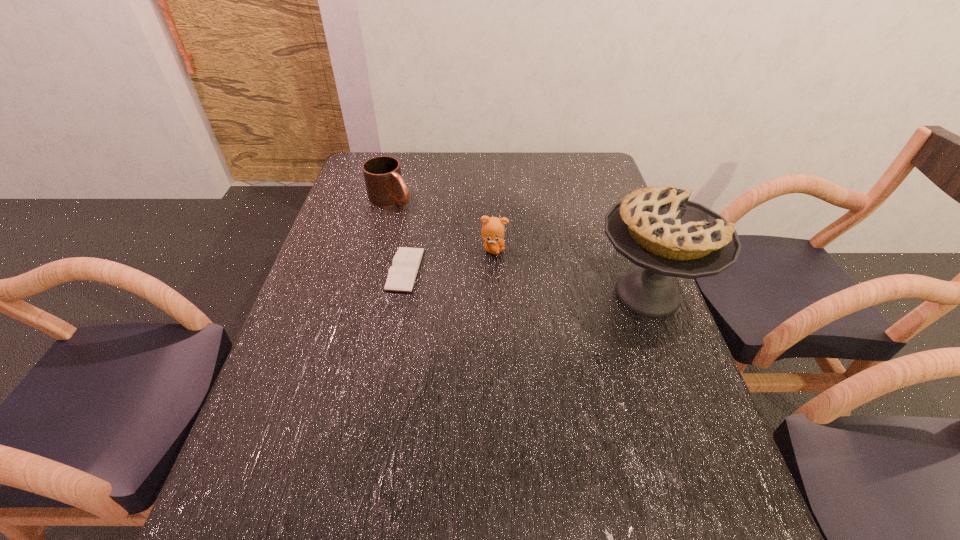
You are a GUI agent. You are given a task and a screenshot of the screen. Output one action in this format:
    pyautogui.click(x=<x>, y=<y>)
    Task: Click on the object that is the third closest to the mug
    
    Given the screenshot: What is the action you would take?
    pyautogui.click(x=657, y=228)

Where is `free point that satisfies the following two spatial constraints: 1. on the front side of the pie; 2. on the cut side of the second object from right to left`? free point that satisfies the following two spatial constraints: 1. on the front side of the pie; 2. on the cut side of the second object from right to left is located at coordinates 495,294.

I want to click on free space that satisfies the following two spatial constraints: 1. on the front side of the pie; 2. on the cut side of the shortest object, so click(401, 294).

The width and height of the screenshot is (960, 540). Find the location of `vacant space that satisfies the following two spatial constraints: 1. on the front side of the mug; 2. on the left side of the diary`. vacant space that satisfies the following two spatial constraints: 1. on the front side of the mug; 2. on the left side of the diary is located at coordinates click(372, 269).

Locate an element on the screen. Image resolution: width=960 pixels, height=540 pixels. free space that satisfies the following two spatial constraints: 1. on the back side of the teddy bear; 2. on the left side of the shortest object is located at coordinates (409, 250).

Image resolution: width=960 pixels, height=540 pixels. Identify the location of blank space that satisfies the following two spatial constraints: 1. on the front side of the pie; 2. on the cut side of the diary. [401, 294].